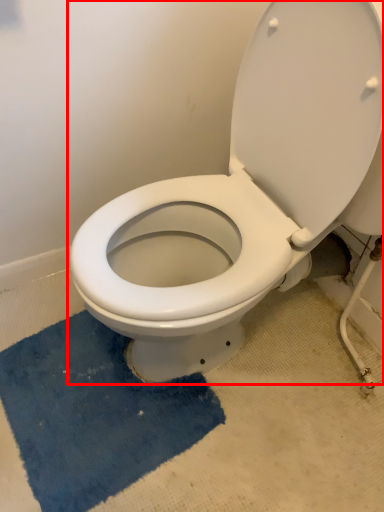
Question: Where is toilet (annotated by the red box) located in relation to bath mat in the image?

Choices:
 (A) right
 (B) left

Answer: (A)